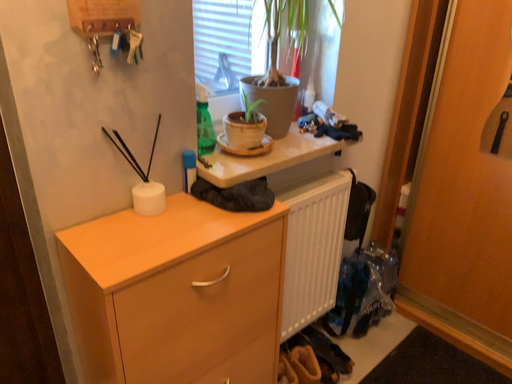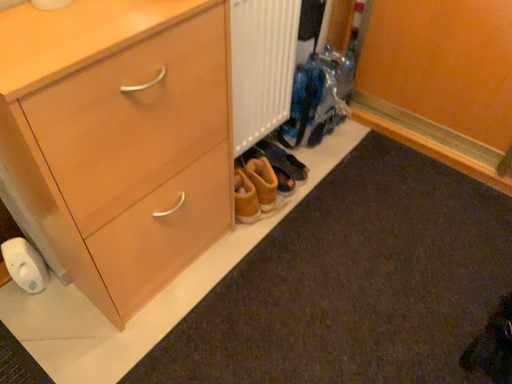
Question: Which way did the camera rotate in the video?

Choices:
 (A) rotated left
 (B) rotated right

Answer: (B)